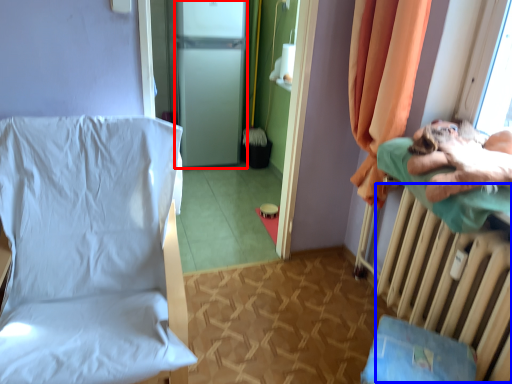
Question: Which object is further to the camera taking this photo, screen door (highlighted by a red box) or radiator (highlighted by a blue box)?

Choices:
 (A) screen door
 (B) radiator

Answer: (A)